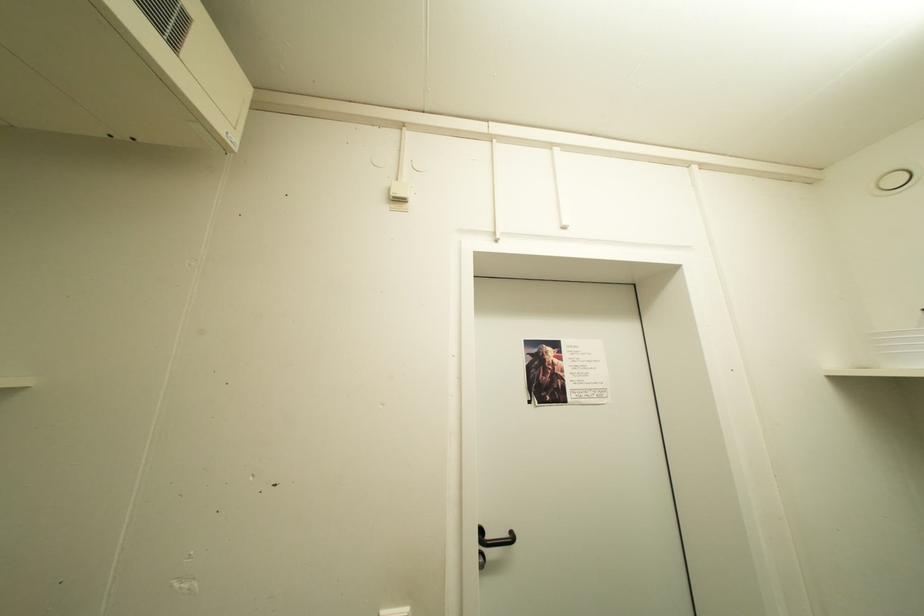
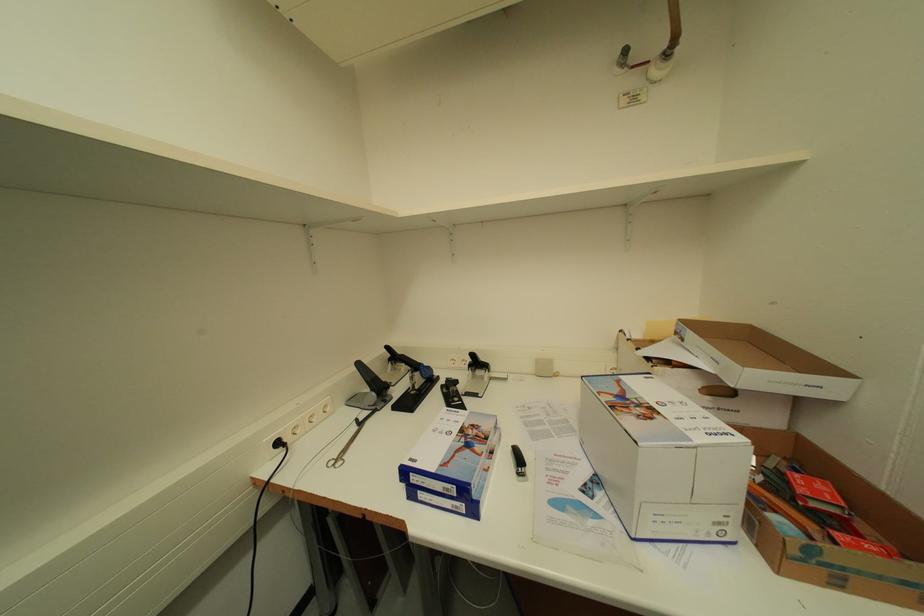
Question: The camera is either moving clockwise (left) or counter-clockwise (right) around the object. The first image is from the beginning of the video and the second image is from the end. Is the camera moving left or right when shooting the video?

Choices:
 (A) Left
 (B) Right

Answer: (B)